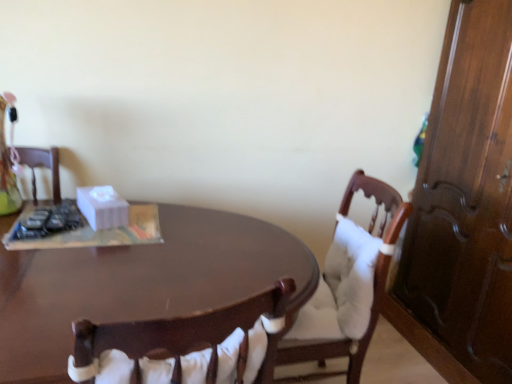
Question: Is wooden chair with white cushion at center thinner than shiny brown desk at center?

Choices:
 (A) no
 (B) yes

Answer: (A)

Question: Does wooden chair with white cushion at center appear on the left side of shiny brown desk at center?

Choices:
 (A) yes
 (B) no

Answer: (B)

Question: Can you confirm if wooden chair with white cushion at center is wider than shiny brown desk at center?

Choices:
 (A) no
 (B) yes

Answer: (B)

Question: From the image's perspective, is wooden chair with white cushion at center on shiny brown desk at center?

Choices:
 (A) no
 (B) yes

Answer: (B)

Question: Considering the relative positions of wooden chair with white cushion at center and shiny brown desk at center in the image provided, is wooden chair with white cushion at center in front of shiny brown desk at center?

Choices:
 (A) yes
 (B) no

Answer: (B)

Question: Would you say shiny brown desk at center is part of wooden chair with white cushion at center's contents?

Choices:
 (A) yes
 (B) no

Answer: (B)

Question: Is wooden chair with white cushion at center facing away from white matte tissue box at center?

Choices:
 (A) yes
 (B) no

Answer: (B)

Question: Does wooden chair with white cushion at center have a larger size compared to white matte tissue box at center?

Choices:
 (A) no
 (B) yes

Answer: (B)

Question: Is white matte tissue box at center inside wooden chair with white cushion at center?

Choices:
 (A) yes
 (B) no

Answer: (B)

Question: Considering the relative sizes of wooden chair with white cushion at center and white matte tissue box at center in the image provided, is wooden chair with white cushion at center taller than white matte tissue box at center?

Choices:
 (A) no
 (B) yes

Answer: (B)

Question: Is the position of wooden chair with white cushion at center more distant than that of white matte tissue box at center?

Choices:
 (A) no
 (B) yes

Answer: (A)

Question: From a real-world perspective, is wooden chair with white cushion at center positioned over white matte tissue box at center based on gravity?

Choices:
 (A) no
 (B) yes

Answer: (A)

Question: Does shiny brown desk at center have a lesser height compared to white matte tissue box at center?

Choices:
 (A) yes
 (B) no

Answer: (B)